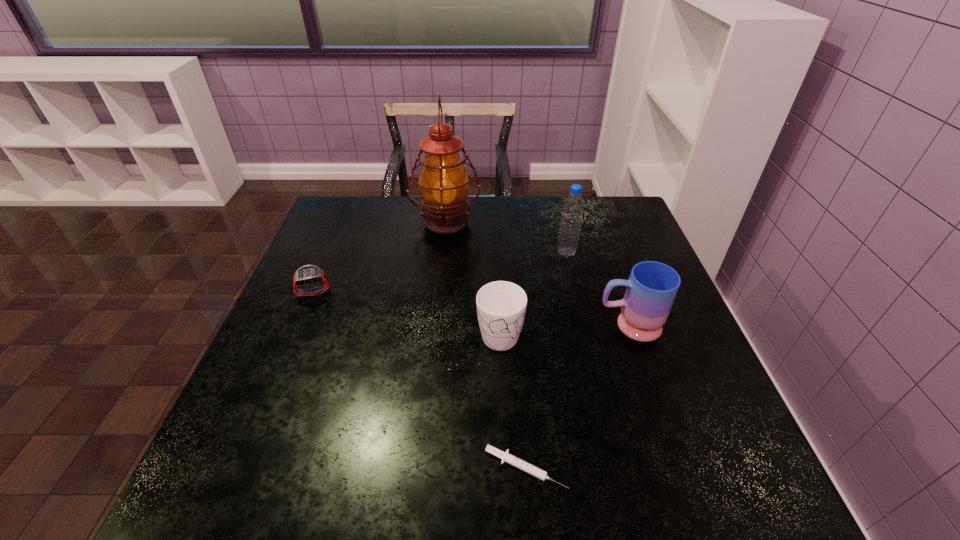
Locate an element on the screen. object that can be found as the fourth closest to the second tallest object is located at coordinates (505, 456).

What are the coordinates of `object that is the closest one to the fourth tallest object` in the screenshot? It's located at (652, 287).

Where is `vacant point that satisfies the following two spatial constraints: 1. on the side of the taller mug with the handle; 2. on the side of the shorter mug with the handle`? vacant point that satisfies the following two spatial constraints: 1. on the side of the taller mug with the handle; 2. on the side of the shorter mug with the handle is located at coordinates (631, 332).

Where is `vacant area in the image that satisfies the following two spatial constraints: 1. on the back side of the second object from right to left; 2. on the right side of the shortest object`? The image size is (960, 540). vacant area in the image that satisfies the following two spatial constraints: 1. on the back side of the second object from right to left; 2. on the right side of the shortest object is located at coordinates (509, 253).